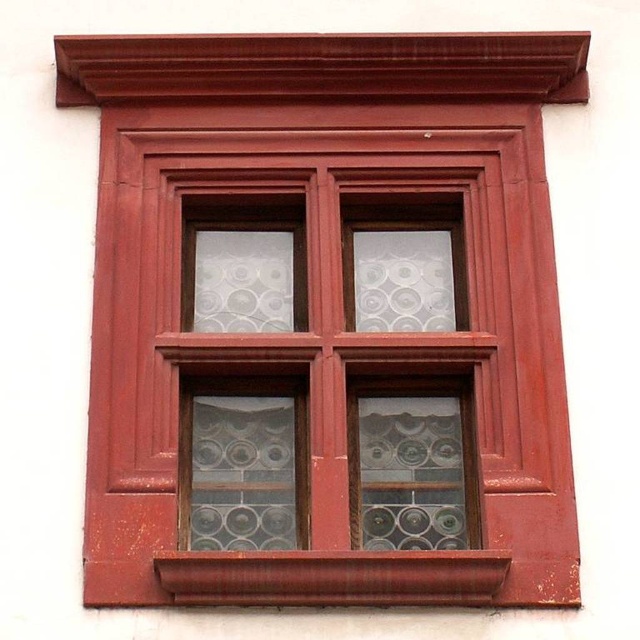
Question: Among these objects, which one is nearest to the camera?

Choices:
 (A) stained glass window at center
 (B) smooth wood window sill at bottom

Answer: (B)

Question: Does stained glass window at center lie behind smooth wood window sill at bottom?

Choices:
 (A) yes
 (B) no

Answer: (A)

Question: Is stained glass window at center to the right of smooth wood window sill at bottom from the viewer's perspective?

Choices:
 (A) no
 (B) yes

Answer: (B)

Question: Is stained glass window at center thinner than smooth wood window sill at bottom?

Choices:
 (A) no
 (B) yes

Answer: (A)

Question: Which point appears closest to the camera in this image?

Choices:
 (A) (305, 422)
 (B) (244, 602)

Answer: (B)